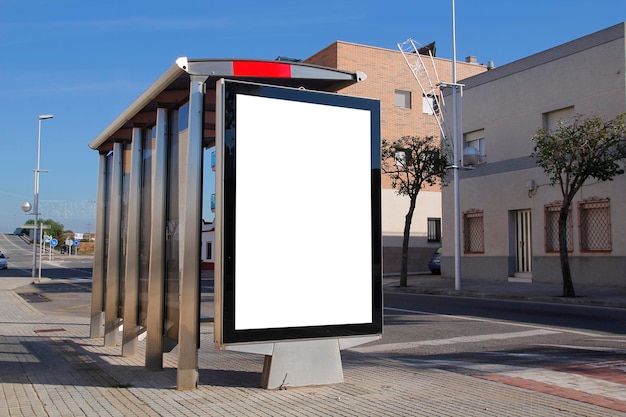
Locate an element on the screen. This screenshot has height=417, width=626. window is located at coordinates (439, 231), (401, 93), (433, 107), (471, 232), (562, 125), (593, 234), (546, 238), (520, 244), (476, 144).